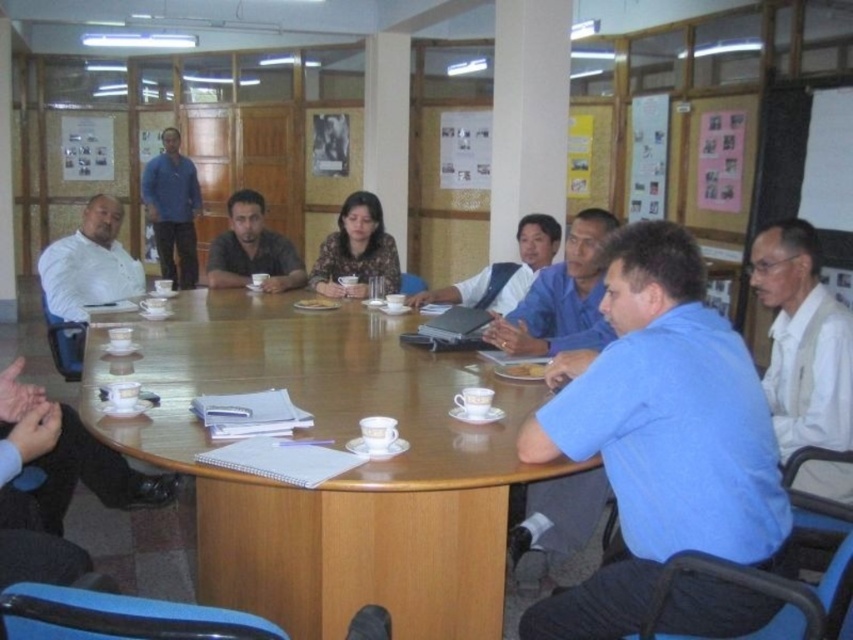
Is white matte shirt at upper left further to camera compared to blue fabric shirt at center?

No, it is not.

Is white matte shirt at upper left wider than blue fabric shirt at center?

In fact, white matte shirt at upper left might be narrower than blue fabric shirt at center.

The image size is (853, 640). Identify the location of white matte shirt at upper left. (90, 264).

The height and width of the screenshot is (640, 853). I want to click on white matte shirt at upper left, so click(x=90, y=264).

Based on the photo, does blue cotton shirt at center appear on the left side of blue fabric shirt at center?

Incorrect, blue cotton shirt at center is not on the left side of blue fabric shirt at center.

Which is below, blue cotton shirt at center or blue fabric shirt at center?

blue cotton shirt at center is lower down.

Image resolution: width=853 pixels, height=640 pixels. What do you see at coordinates (659, 435) in the screenshot? I see `blue cotton shirt at center` at bounding box center [659, 435].

Locate an element on the screen. blue cotton shirt at center is located at coordinates (659, 435).

Who is lower down, white textured shirt at right or blue cotton shirt at upper left?

white textured shirt at right is lower down.

Between point (833, 344) and point (165, 144), which one is positioned behind?

The point (165, 144) is more distant.

Find the location of a particular element. Image resolution: width=853 pixels, height=640 pixels. white textured shirt at right is located at coordinates (804, 340).

Find the location of `white textured shirt at right`. white textured shirt at right is located at coordinates pos(804,340).